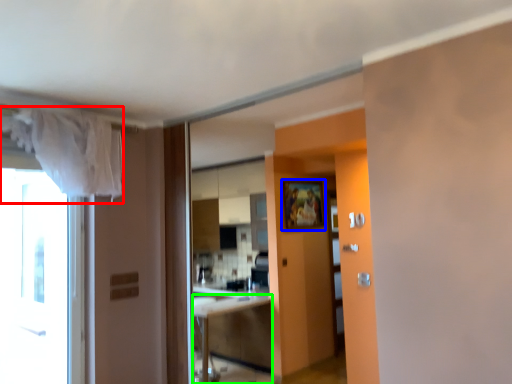
Question: Which object is positioned closest to curtain (highlighted by a red box)? Select from picture frame (highlighted by a blue box) and cabinetry (highlighted by a green box).

Choices:
 (A) picture frame
 (B) cabinetry

Answer: (A)